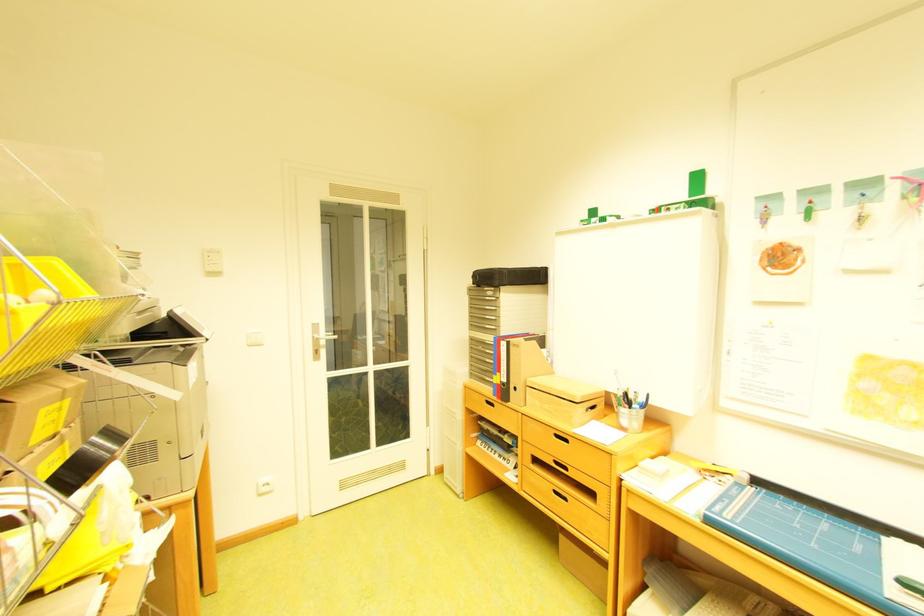
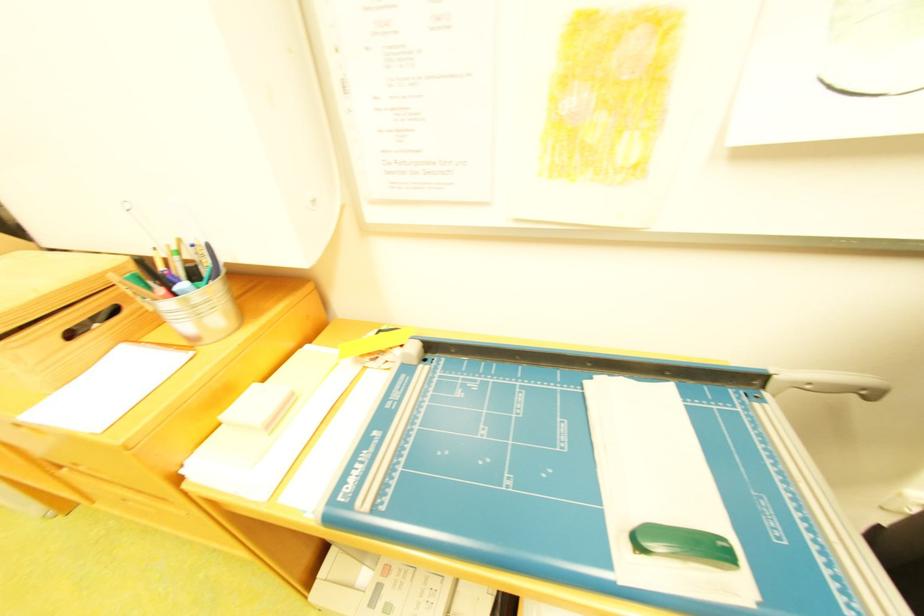
In the second image, find the point that corresponds to the point at 638,407 in the first image.

(173, 292)